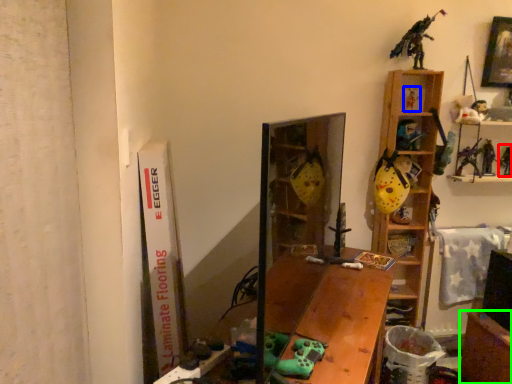
Question: Based on their relative distances, which object is farther from toy (highlighted by a red box)? Choose from toy (highlighted by a blue box) and table (highlighted by a green box).

Choices:
 (A) toy
 (B) table

Answer: (B)